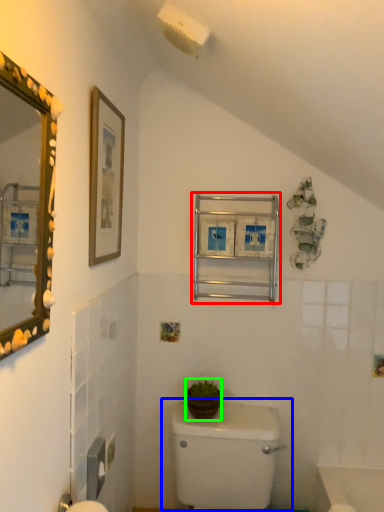
Question: Which object is the closest to the medicine cabinet (highlighted by a red box)? Choose among these: toilet (highlighted by a blue box) or plant (highlighted by a green box).

Choices:
 (A) toilet
 (B) plant

Answer: (B)